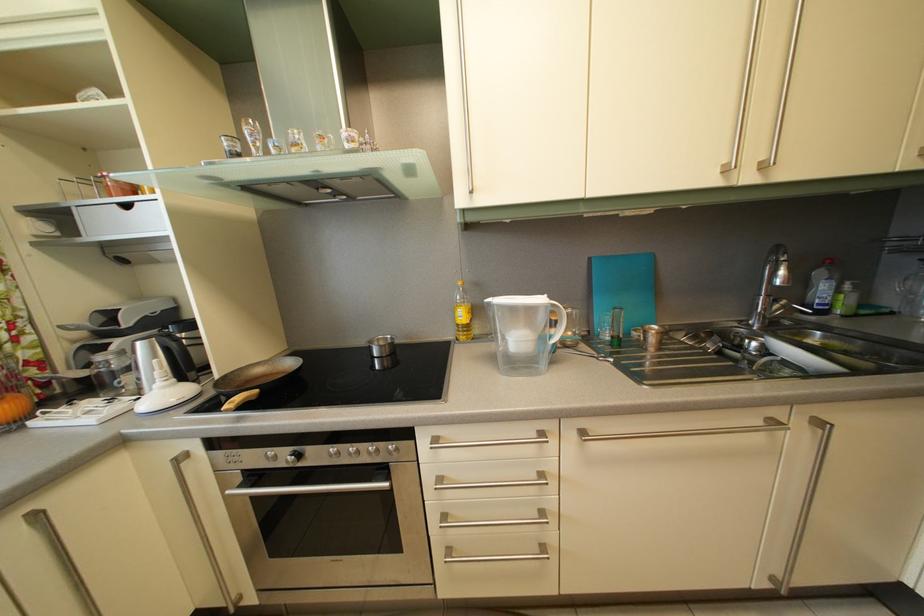
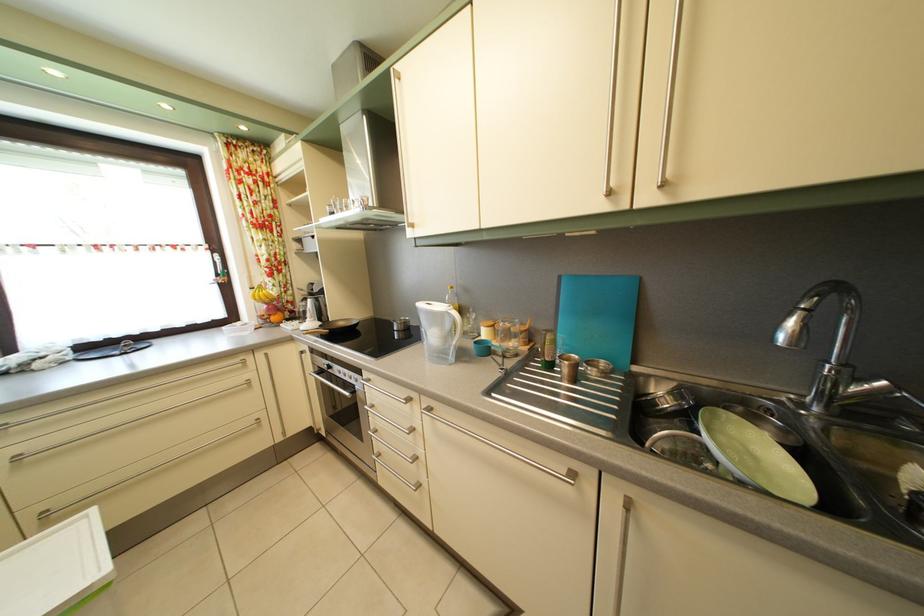
The point at (406,349) is marked in the first image. Where is the corresponding point in the second image?

(420, 331)